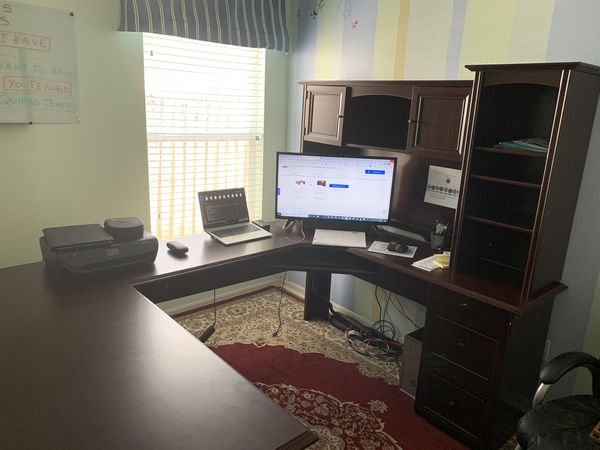
Where is `red part of rug`? red part of rug is located at coordinates (308, 367).